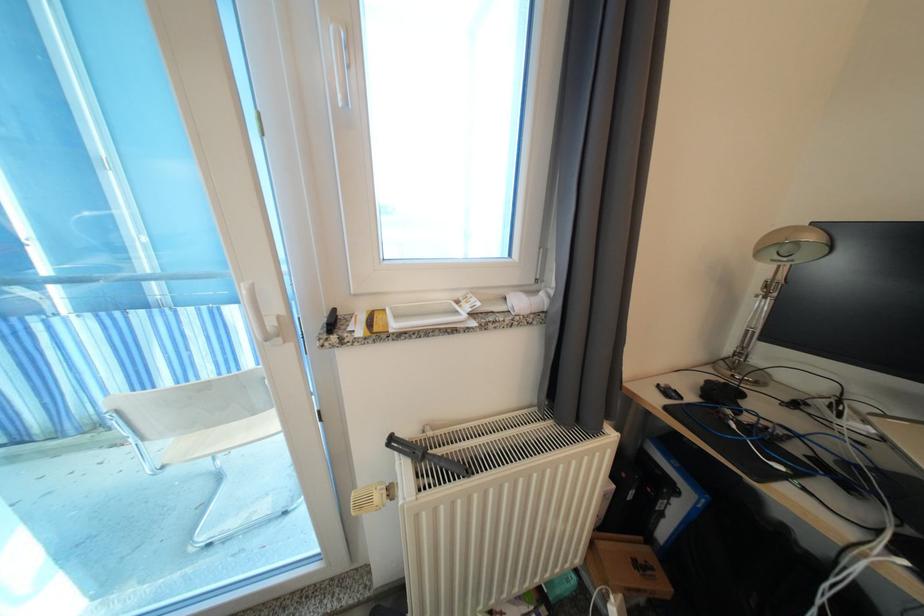
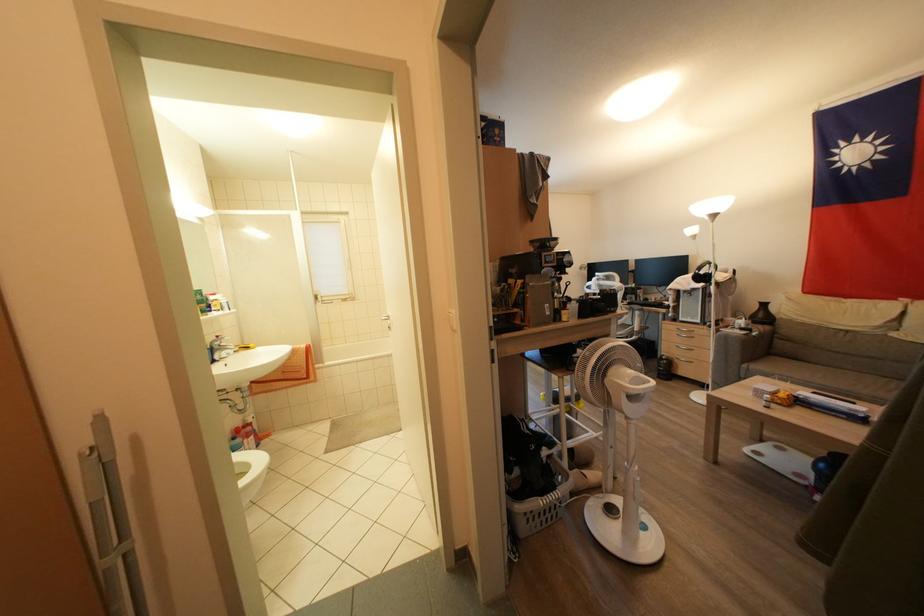
Question: I am providing you with two images of the same scene from different viewpoints. Which of the following objects are not visible in image2?

Choices:
 (A) white window handle
 (B) white toilet seat
 (C) printer key lock
 (D) black vase

Answer: (A)